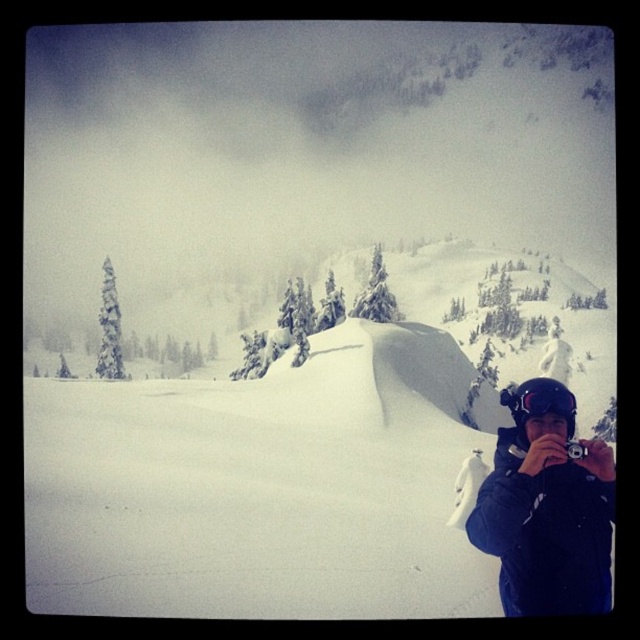
You are a photographer standing in the snowy mountain landscape. You want to capture a photo that includes both the white fluffy snow at center and the dark blue jacket at lower right. Based on their positions, which object should you adjust your camera angle to include first if you need to pan from left to right?

The white fluffy snow at center is to the left of the dark blue jacket at lower right, so you should first pan your camera to the left to include the white fluffy snow at center before moving to the right to capture the dark blue jacket at lower right.

You are standing at the point marked as point [262,486] in the image. What is the terrain like at that location?

The terrain at point [262,486] is white fluffy snow at center.

You are a photographer trying to capture the snow scene. You have a dark blue jacket at lower right and a black plastic camera at lower right. Which object is bigger in the image?

The dark blue jacket at lower right is larger in size compared to the black plastic camera at lower right.